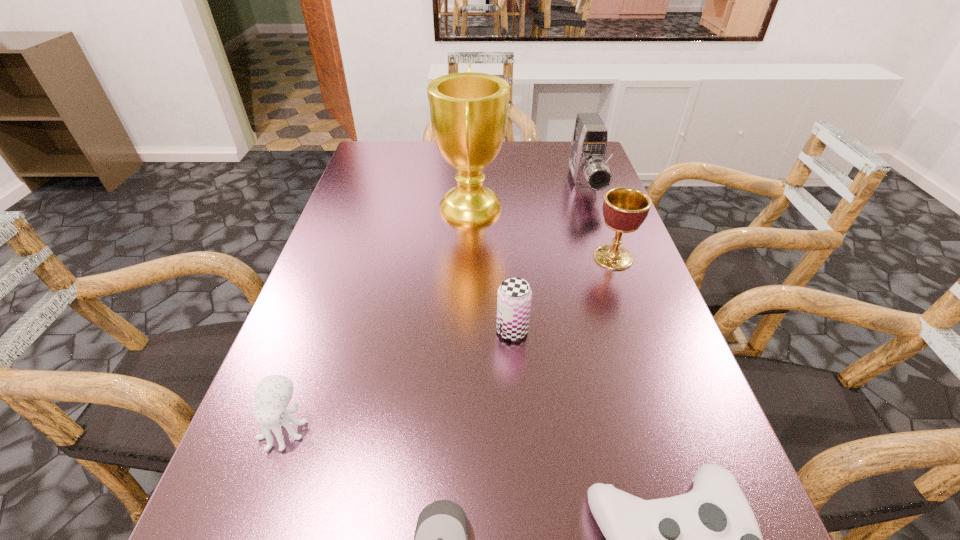
You are a GUI agent. You are given a task and a screenshot of the screen. Output one action in this format:
    pyautogui.click(x=<x>, y=<y>)
    Task: Click on the object that stands as the fourth closest to the computer equipment
    The width and height of the screenshot is (960, 540).
    Given the screenshot: What is the action you would take?
    pyautogui.click(x=624, y=209)

At what (x,y) coordinates should I click in order to perform the action: click on free space that satisfies the following two spatial constraints: 1. at the front of the camcorder, highlighting the lens; 2. on the shiny surface of the tallest object. Please return your answer as a coordinate pair (x, y). The image size is (960, 540). Looking at the image, I should click on (592, 206).

The height and width of the screenshot is (540, 960). I want to click on vacant area in the image that satisfies the following two spatial constraints: 1. on the shiny surface of the chalice; 2. on the left side of the tallest object, so click(469, 258).

You are a GUI agent. You are given a task and a screenshot of the screen. Output one action in this format:
    pyautogui.click(x=<x>, y=<y>)
    Task: Click on the blank space that satisfies the following two spatial constraints: 1. on the shiny surface of the tallest object; 2. on the right side of the chalice
    The image size is (960, 540).
    Given the screenshot: What is the action you would take?
    pyautogui.click(x=469, y=258)